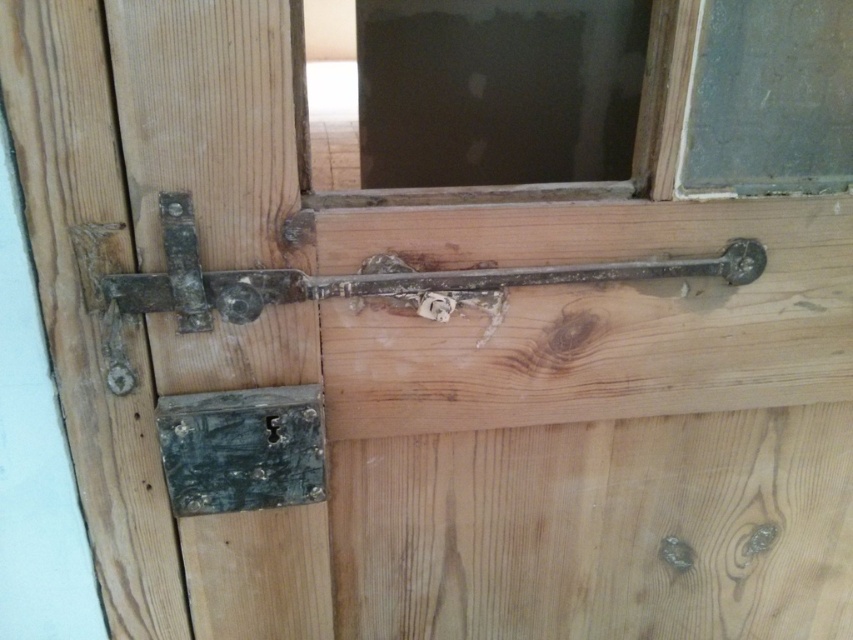
Question: Among these objects, which one is nearest to the camera?

Choices:
 (A) transparent glass window at upper center
 (B) rusty metal lock at lower left

Answer: (A)

Question: Does transparent glass window at upper center lie in front of rusty metal lock at lower left?

Choices:
 (A) yes
 (B) no

Answer: (A)

Question: Is transparent glass window at upper center smaller than rusty metal lock at lower left?

Choices:
 (A) yes
 (B) no

Answer: (B)

Question: Which of the following is the closest to the observer?

Choices:
 (A) rusty metal lock at lower left
 (B) transparent glass window at upper center

Answer: (B)

Question: Does transparent glass window at upper center lie in front of rusty metal lock at lower left?

Choices:
 (A) yes
 (B) no

Answer: (A)